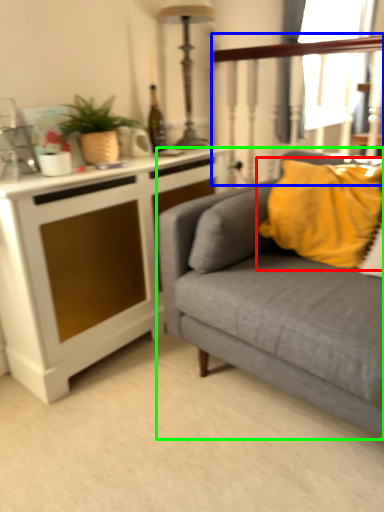
Question: Considering the real-world distances, which object is closest to pillow (highlighted by a red box)? rail (highlighted by a blue box) or studio couch (highlighted by a green box).

Choices:
 (A) rail
 (B) studio couch

Answer: (B)